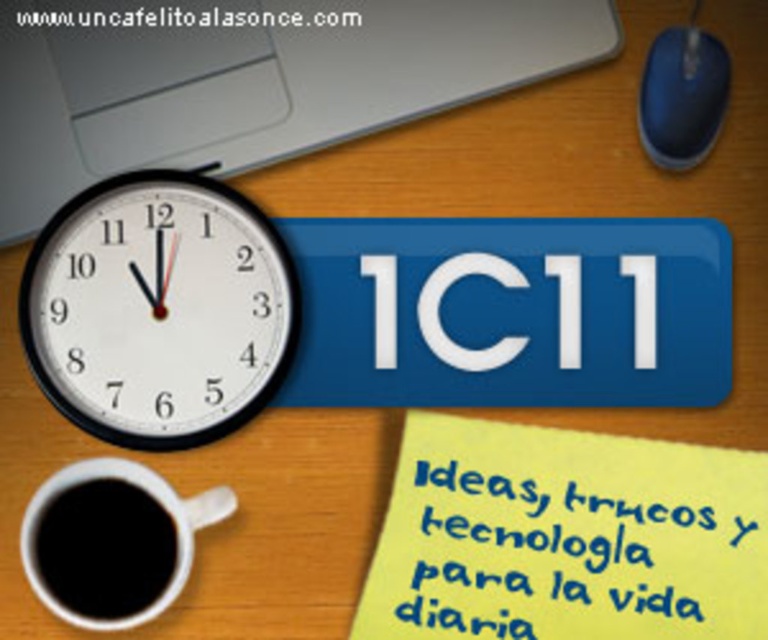
Can you confirm if white plastic clock at left is bigger than white paper at upper center?

Yes, white plastic clock at left is bigger than white paper at upper center.

Is white plastic clock at left above white paper at upper center?

Incorrect, white plastic clock at left is not positioned above white paper at upper center.

The height and width of the screenshot is (640, 768). I want to click on white plastic clock at left, so click(157, 308).

Is blue plastic mouse at upper right to the right of white paper at upper center from the viewer's perspective?

Yes, blue plastic mouse at upper right is to the right of white paper at upper center.

Can you confirm if blue plastic mouse at upper right is positioned to the left of white paper at upper center?

Incorrect, blue plastic mouse at upper right is not on the left side of white paper at upper center.

The width and height of the screenshot is (768, 640). What are the coordinates of `blue plastic mouse at upper right` in the screenshot? It's located at click(682, 93).

Which is below, silver metallic laptop at upper left or black matte cup at lower left?

black matte cup at lower left

Does silver metallic laptop at upper left appear under black matte cup at lower left?

Actually, silver metallic laptop at upper left is above black matte cup at lower left.

Which is behind, point (124, 102) or point (85, 560)?

Point (124, 102)

At what (x,y) coordinates should I click in order to perform the action: click on silver metallic laptop at upper left. Please return your answer as a coordinate pair (x, y). This screenshot has height=640, width=768. Looking at the image, I should click on (250, 80).